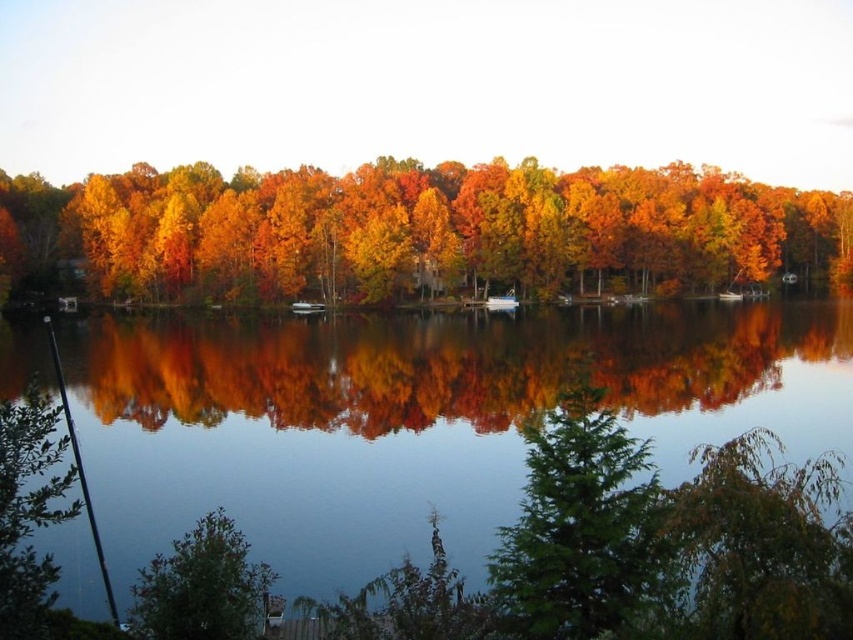
Question: In this image, where is green matte tree at center located relative to white glossy boat at center?

Choices:
 (A) left
 (B) right

Answer: (B)

Question: Is transparent water at center to the right of green matte tree at lower right from the viewer's perspective?

Choices:
 (A) no
 (B) yes

Answer: (A)

Question: Estimate the real-world distances between objects in this image. Which object is closer to the green matte tree at lower right?

Choices:
 (A) white glossy boat at center
 (B) green matte tree at center
 (C) autumn leaves at center

Answer: (B)

Question: Is transparent water at center bigger than green matte tree at center?

Choices:
 (A) yes
 (B) no

Answer: (A)

Question: Which point appears farthest from the camera in this image?

Choices:
 (A) (317, 314)
 (B) (140, 184)
 (C) (582, 515)
 (D) (108, 493)

Answer: (B)

Question: Which point is farther from the camera taking this photo?

Choices:
 (A) (567, 209)
 (B) (706, 481)

Answer: (A)